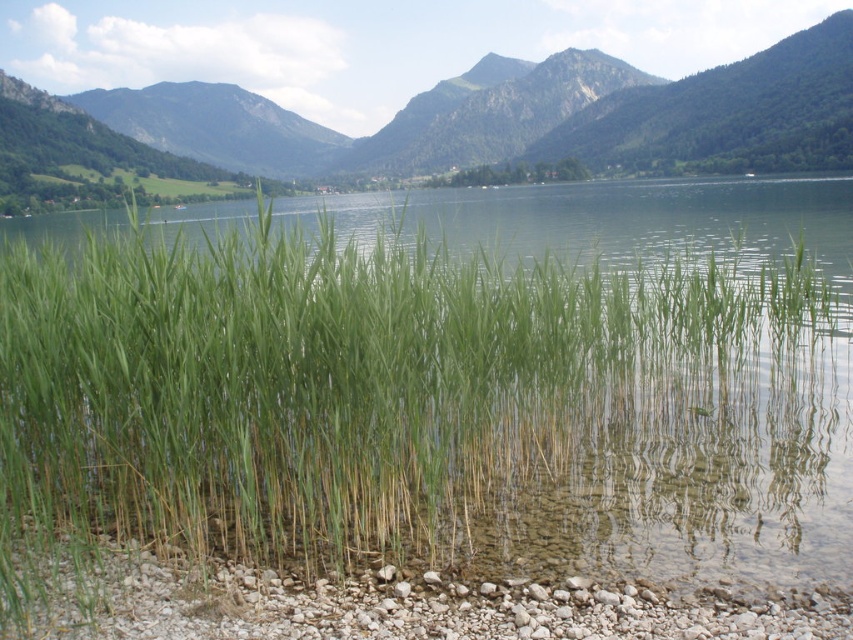
You are standing at the lakeside and want to know which area is larger between the green grass at center and the green leafy vegetation at center. Which one takes up more space?

The green leafy vegetation at center occupies more space than the green grass at center.

You are standing at the edge of the lake and want to walk towards the smooth pebbles at lower center. Are the green leafy vegetation at center blocking your path?

The green leafy vegetation at center is further to the viewer than smooth pebbles at lower center, so the green leafy vegetation at center is closer to you and would block your path to the smooth pebbles at lower center.